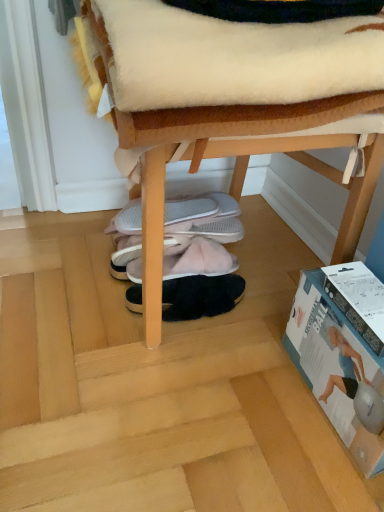
Question: Considering the positions of white fabric slippers at center, which is the third footwear from bottom to top, and wooden chair at center in the image, is white fabric slippers at center, which is the third footwear from bottom to top, taller or shorter than wooden chair at center?

Choices:
 (A) short
 (B) tall

Answer: (A)

Question: Based on their sizes in the image, would you say white fabric slippers at center, which is the third footwear from bottom to top, is bigger or smaller than wooden chair at center?

Choices:
 (A) big
 (B) small

Answer: (B)

Question: Based on their relative distances, which object is nearer to the pink fuzzy slippers at center, which ranks as the second footwear in top-to-bottom order?

Choices:
 (A) white fabric slippers at center, which is the third footwear from bottom to top
 (B) white cardboard box at lower right
 (C) black fuzzy slippers at center, which appears as the third footwear when viewed from the top
 (D) wooden chair at center

Answer: (C)

Question: Which object is positioned farthest from the black fuzzy slippers at center, the first footwear ordered from the bottom?

Choices:
 (A) white fabric slippers at center, which is the third footwear from bottom to top
 (B) wooden chair at center
 (C) white cardboard box at lower right
 (D) pink fuzzy slippers at center, the second footwear ordered from the bottom

Answer: (B)